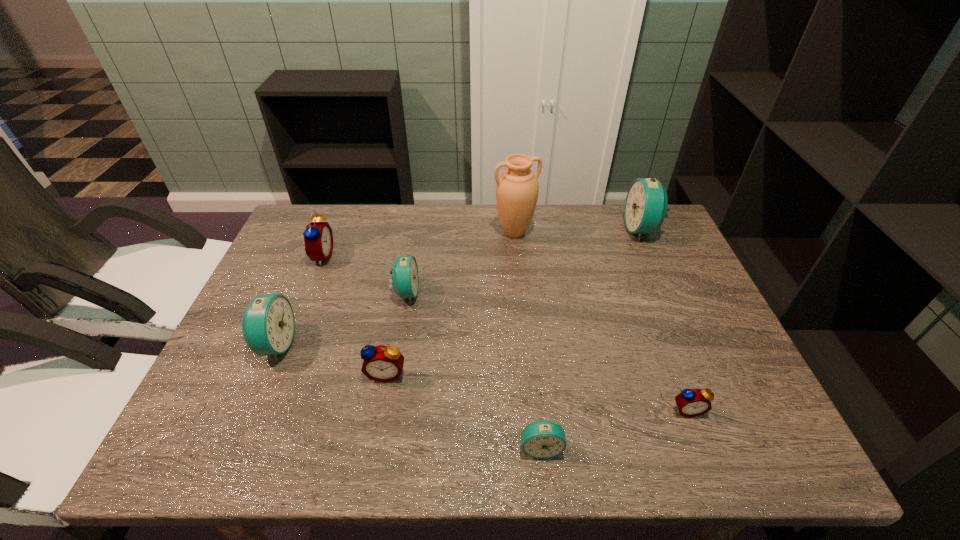
This screenshot has width=960, height=540. I want to click on urn, so click(517, 188).

The height and width of the screenshot is (540, 960). Find the location of `the tallest alarm clock`. the tallest alarm clock is located at coordinates (646, 203).

Identify the location of the rightmost blue alarm clock. The width and height of the screenshot is (960, 540). (646, 203).

Find the location of a particular element. The height and width of the screenshot is (540, 960). the biggest red alarm clock is located at coordinates (318, 238).

I want to click on the leftmost red alarm clock, so click(318, 238).

Where is `the leftmost blue alarm clock`? the leftmost blue alarm clock is located at coordinates (268, 324).

Where is `the third farthest blue alarm clock`? the third farthest blue alarm clock is located at coordinates (268, 324).

What are the coordinates of `the third blue alarm clock from right to left` in the screenshot? It's located at (405, 279).

Locate an element on the screen. The width and height of the screenshot is (960, 540). the fifth nearest alarm clock is located at coordinates (405, 279).

Image resolution: width=960 pixels, height=540 pixels. In order to click on the second red alarm clock from left to right in this screenshot , I will do `click(381, 363)`.